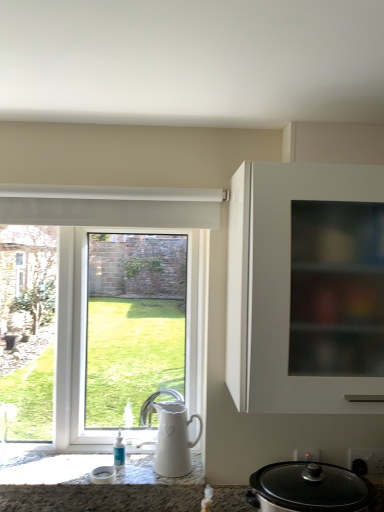
This screenshot has height=512, width=384. What do you see at coordinates (118, 306) in the screenshot?
I see `white glossy window at left` at bounding box center [118, 306].

This screenshot has width=384, height=512. What do you see at coordinates (282, 283) in the screenshot?
I see `white matte cabinet at right` at bounding box center [282, 283].

Find the location of a particular element. white glossy window at left is located at coordinates (118, 306).

Can you confirm if white ceramic jug at lower center is taller than white glossy window at left?

Incorrect, the height of white ceramic jug at lower center is not larger of that of white glossy window at left.

Which object is further away from the camera, white ceramic jug at lower center or white glossy window at left?

white glossy window at left is further away from the camera.

Does white ceramic jug at lower center appear on the left side of white glossy window at left?

No, white ceramic jug at lower center is not to the left of white glossy window at left.

Does white ceramic jug at lower center have a lesser width compared to white glossy window at left?

Yes.

Who is shorter, white glossy window at left or black glass slow cooker at lower right?

With less height is black glass slow cooker at lower right.

Is point (136, 259) closer or farther from the camera than point (285, 474)?

Point (136, 259) is farther from the camera than point (285, 474).

Is white glossy window at left looking in the opposite direction of black glass slow cooker at lower right?

No, white glossy window at left's orientation is not away from black glass slow cooker at lower right.

Is black glass slow cooker at lower right located within white glossy window at left?

No, black glass slow cooker at lower right is not a part of white glossy window at left.

From a real-world perspective, relative to white ceramic jug at lower center, is white glossy window at left vertically above or below?

white glossy window at left is situated higher than white ceramic jug at lower center in the real world.

Find the location of a particular element. window on the left side of white ceramic jug at lower center is located at coordinates (118, 306).

Does white glossy window at left come in front of white ceramic jug at lower center?

No.

Is white glossy window at left bigger or smaller than white ceramic jug at lower center?

Clearly, white glossy window at left is larger in size than white ceramic jug at lower center.

The width and height of the screenshot is (384, 512). In order to click on kitchen appliance that appears on the right of white glossy window at left in this screenshot , I will do `click(309, 488)`.

In the scene shown: Can you confirm if black glass slow cooker at lower right is wider than white glossy window at left?

Yes, black glass slow cooker at lower right is wider than white glossy window at left.

Is black glass slow cooker at lower right positioned with its back to white glossy window at left?

No, white glossy window at left is not at the back of black glass slow cooker at lower right.

Is black glass slow cooker at lower right with white glossy window at left?

No, black glass slow cooker at lower right is not beside white glossy window at left.

From a real-world perspective, is black glass slow cooker at lower right positioned under white ceramic jug at lower center based on gravity?

Yes.

Which object is positioned more to the right, black glass slow cooker at lower right or white ceramic jug at lower center?

black glass slow cooker at lower right.

Is black glass slow cooker at lower right smaller than white ceramic jug at lower center?

Actually, black glass slow cooker at lower right might be larger than white ceramic jug at lower center.

From the picture: Considering the sizes of objects black glass slow cooker at lower right and white ceramic jug at lower center in the image provided, who is shorter, black glass slow cooker at lower right or white ceramic jug at lower center?

Standing shorter between the two is white ceramic jug at lower center.

Between point (282, 462) and point (266, 365), which one is positioned in front?

The point (266, 365) is closer.

Could you tell me if black glass slow cooker at lower right is facing white matte cabinet at right?

No, black glass slow cooker at lower right does not turn towards white matte cabinet at right.

Considering the positions of objects black glass slow cooker at lower right and white matte cabinet at right in the image provided, who is behind, black glass slow cooker at lower right or white matte cabinet at right?

black glass slow cooker at lower right is further from the camera.

Find the location of a particular element. The width and height of the screenshot is (384, 512). kitchen appliance lying behind the white matte cabinet at right is located at coordinates (309, 488).

This screenshot has height=512, width=384. Find the location of `cabinetry on the right of white glossy window at left`. cabinetry on the right of white glossy window at left is located at coordinates (282, 283).

Is white matte cabinet at right located within white glossy window at left?

Actually, white matte cabinet at right is outside white glossy window at left.

Visually, is white glossy window at left positioned to the left or to the right of white matte cabinet at right?

Based on their positions, white glossy window at left is located to the left of white matte cabinet at right.

Where is `window on the left of white ceramic jug at lower center`? The image size is (384, 512). window on the left of white ceramic jug at lower center is located at coordinates (118, 306).

Locate an element on the screen. Image resolution: width=384 pixels, height=512 pixels. window above the black glass slow cooker at lower right (from the image's perspective) is located at coordinates (118, 306).

Considering their positions, is white matte cabinet at right positioned further to white glossy window at left than black glass slow cooker at lower right?

black glass slow cooker at lower right.

When comparing their distances from black glass slow cooker at lower right, does white matte cabinet at right or white glossy window at left seem further?

white glossy window at left.

When comparing their distances from black glass slow cooker at lower right, does white glossy window at left or white ceramic jug at lower center seem further?

white glossy window at left is further to black glass slow cooker at lower right.

Based on their spatial positions, is white matte cabinet at right or white glossy window at left closer to white ceramic jug at lower center?

white glossy window at left is closer to white ceramic jug at lower center.

From the image, which object appears to be farther from white matte cabinet at right, white ceramic jug at lower center or white glossy window at left?

white ceramic jug at lower center is positioned further to the anchor white matte cabinet at right.

Consider the image. When comparing their distances from white matte cabinet at right, does black glass slow cooker at lower right or white ceramic jug at lower center seem closer?

black glass slow cooker at lower right is closer to white matte cabinet at right.

Considering their positions, is white ceramic jug at lower center positioned closer to white glossy window at left than white matte cabinet at right?

Based on the image, white ceramic jug at lower center appears to be nearer to white glossy window at left.

Based on their spatial positions, is white matte cabinet at right or black glass slow cooker at lower right further from white ceramic jug at lower center?

white matte cabinet at right.

Locate an element on the screen. This screenshot has width=384, height=512. kitchen appliance situated between white glossy window at left and white matte cabinet at right from left to right is located at coordinates (309, 488).

What are the coordinates of `jug between white glossy window at left and black glass slow cooker at lower right from left to right` in the screenshot? It's located at (173, 440).

The height and width of the screenshot is (512, 384). Identify the location of jug between white matte cabinet at right and black glass slow cooker at lower right vertically. (173, 440).

Locate an element on the screen. jug between white glossy window at left and white matte cabinet at right is located at coordinates (173, 440).